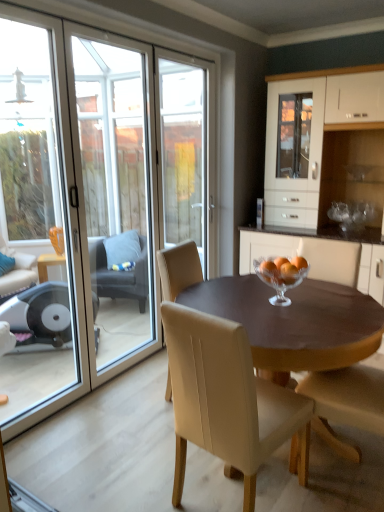
How much space does dark gray fabric chair at left, marked as the first chair in a back-to-front arrangement, occupy horizontally?

dark gray fabric chair at left, marked as the first chair in a back-to-front arrangement, is 54.59 centimeters wide.

Find the location of a particular element. The height and width of the screenshot is (512, 384). clear glass bowl at center is located at coordinates (281, 275).

What do you see at coordinates (116, 195) in the screenshot? I see `transparent glass screen door at left` at bounding box center [116, 195].

At what (x,y) coordinates should I click in order to perform the action: click on transparent glass screen door at left. Please return your answer as a coordinate pair (x, y). Image resolution: width=384 pixels, height=512 pixels. Looking at the image, I should click on (116, 195).

Find the location of a particular element. The height and width of the screenshot is (512, 384). beige leather chair at center, which is counted as the 4th chair, starting from the left is located at coordinates (333, 260).

How distant is dark gray fabric chair at left, the fourth chair when ordered from front to back, from beige leather chair at center, which is counted as the 4th chair, starting from the left?

6.82 feet.

Is dark gray fabric chair at left, marked as the first chair in a back-to-front arrangement, next to beige leather chair at center, arranged as the third chair when viewed from the back?

dark gray fabric chair at left, marked as the first chair in a back-to-front arrangement, and beige leather chair at center, arranged as the third chair when viewed from the back, are clearly separated.

Is dark gray fabric chair at left, arranged as the first chair when viewed from the left, taller than beige leather chair at center, arranged as the first chair when viewed from the right?

In fact, dark gray fabric chair at left, arranged as the first chair when viewed from the left, may be shorter than beige leather chair at center, arranged as the first chair when viewed from the right.

Is point (93, 281) positioned in front of point (307, 237)?

No, it is not.

In terms of height, does dark gray fabric chair at left, arranged as the first chair when viewed from the left, look taller or shorter compared to beige leather chair at center, the third chair when ordered from right to left?

Clearly, dark gray fabric chair at left, arranged as the first chair when viewed from the left, is shorter compared to beige leather chair at center, the third chair when ordered from right to left.

Is dark gray fabric chair at left, the fourth chair when ordered from front to back, wider than beige leather chair at center, the third chair when ordered from right to left?

Yes, dark gray fabric chair at left, the fourth chair when ordered from front to back, is wider than beige leather chair at center, the third chair when ordered from right to left.

How distant is dark gray fabric chair at left, marked as the first chair in a back-to-front arrangement, from beige leather chair at center, which is counted as the 2th chair, starting from the left?

dark gray fabric chair at left, marked as the first chair in a back-to-front arrangement, and beige leather chair at center, which is counted as the 2th chair, starting from the left, are 1.56 meters apart.

In order to click on the 1st chair in front of the dark gray fabric chair at left, the fourth chair when ordered from front to back in this screenshot , I will do `click(179, 269)`.

This screenshot has width=384, height=512. Find the location of `cabinetry located above the wooden table at center (from a real-world perspective)`. cabinetry located above the wooden table at center (from a real-world perspective) is located at coordinates (326, 145).

Does white glossy cabinet at center have a greater width compared to wooden table at center?

Incorrect, the width of white glossy cabinet at center does not surpass that of wooden table at center.

Can you confirm if white glossy cabinet at center is positioned to the right of wooden table at center?

Indeed, white glossy cabinet at center is positioned on the right side of wooden table at center.

Would you say white glossy cabinet at center is inside or outside wooden table at center?

white glossy cabinet at center is not inside wooden table at center, it's outside.

Is transparent glass door at left positioned before wooden table at center?

No, transparent glass door at left is behind wooden table at center.

Is point (35, 169) more distant than point (303, 314)?

That is True.

Is transparent glass door at left bigger than wooden table at center?

Actually, transparent glass door at left might be smaller than wooden table at center.

Would you say beige leather chair at center, which ranks as the 2th chair in right-to-left order, is inside or outside transparent glass screen door at left?

The correct answer is: outside.

Between beige leather chair at center, the first chair positioned from the front, and transparent glass screen door at left, which one is positioned behind?

transparent glass screen door at left.

From the image's perspective, would you say beige leather chair at center, arranged as the 3th chair when viewed from the left, is positioned over transparent glass screen door at left?

No.

From a real-world perspective, between beige leather chair at center, which is the 2th chair in back-to-front order, and beige leather chair at center, which is counted as the 4th chair, starting from the left, who is vertically higher?

beige leather chair at center, which is counted as the 4th chair, starting from the left, from a real-world perspective.

Which of these two, beige leather chair at center, positioned as the 3th chair in front-to-back order, or beige leather chair at center, arranged as the first chair when viewed from the right, is smaller?

Smaller between the two is beige leather chair at center, positioned as the 3th chair in front-to-back order.

Is beige leather chair at center, which is the 2th chair in back-to-front order, further to the viewer compared to beige leather chair at center, arranged as the third chair when viewed from the back?

Yes, it is.

Between beige leather chair at center, positioned as the 3th chair in front-to-back order, and beige leather chair at center, which is counted as the 4th chair, starting from the left, which one has less height?

Standing shorter between the two is beige leather chair at center, which is counted as the 4th chair, starting from the left.

Which is more distant, (x=143, y=269) or (x=291, y=261)?

The point (x=143, y=269) is behind.

Consider the image. From the image's perspective, is dark gray fabric chair at left, marked as the first chair in a back-to-front arrangement, positioned above or below clear glass bowl at center?

Clearly, from the image's perspective, dark gray fabric chair at left, marked as the first chair in a back-to-front arrangement, is below clear glass bowl at center.

Is dark gray fabric chair at left, arranged as the first chair when viewed from the left, far from clear glass bowl at center?

Yes.

Considering the sizes of objects dark gray fabric chair at left, arranged as the first chair when viewed from the left, and clear glass bowl at center in the image provided, who is thinner, dark gray fabric chair at left, arranged as the first chair when viewed from the left, or clear glass bowl at center?

clear glass bowl at center is thinner.

I want to click on the 3rd chair positioned below the beige leather chair at center, acting as the 2th chair starting from the front (from a real-world perspective), so click(x=118, y=274).

You are a GUI agent. You are given a task and a screenshot of the screen. Output one action in this format:
    pyautogui.click(x=<x>, y=<y>)
    Task: Click on the 2nd chair positioned above the dark gray fabric chair at left, marked as the first chair in a back-to-front arrangement (from a real-world perspective)
    
    Given the screenshot: What is the action you would take?
    pyautogui.click(x=179, y=269)

Which object lies further to the anchor point transparent glass screen door at left, beige leather chair at center, arranged as the first chair when viewed from the right, or white glossy cabinet at center?

beige leather chair at center, arranged as the first chair when viewed from the right, is further to transparent glass screen door at left.

Estimate the real-world distances between objects in this image. Which object is closer to white glossy cabinet at center, clear glass bowl at center or transparent glass screen door at left?

Based on the image, clear glass bowl at center appears to be nearer to white glossy cabinet at center.

Considering their positions, is beige leather chair at center, arranged as the first chair when viewed from the right, positioned closer to transparent glass door at left than transparent glass screen door at left?

Among the two, transparent glass screen door at left is located nearer to transparent glass door at left.

From the image, which object appears to be farther from beige leather chair at center, the third chair when ordered from right to left, clear glass bowl at center or transparent glass door at left?

The object further to beige leather chair at center, the third chair when ordered from right to left, is transparent glass door at left.

Estimate the real-world distances between objects in this image. Which object is further from transparent glass screen door at left, white glossy cabinet at center or transparent glass door at left?

white glossy cabinet at center is positioned further to the anchor transparent glass screen door at left.

Looking at the image, which one is located closer to dark gray fabric chair at left, arranged as the first chair when viewed from the left, beige leather chair at center, which ranks as the 2th chair in right-to-left order, or clear glass bowl at center?

clear glass bowl at center is closer to dark gray fabric chair at left, arranged as the first chair when viewed from the left.

Consider the image. Based on their spatial positions, is clear glass bowl at center or white glossy cabinet at center closer to dark gray fabric chair at left, arranged as the first chair when viewed from the left?

white glossy cabinet at center is closer to dark gray fabric chair at left, arranged as the first chair when viewed from the left.

Looking at the image, which one is located further to clear glass bowl at center, wooden table at center or white glossy cabinet at center?

white glossy cabinet at center is positioned further to the anchor clear glass bowl at center.

The width and height of the screenshot is (384, 512). I want to click on glass bowl between transparent glass screen door at left and beige leather chair at center, which is counted as the 4th chair, starting from the left, so click(281, 275).

This screenshot has height=512, width=384. Identify the location of glass bowl between transparent glass door at left and beige leather chair at center, which ranks as the 2th chair in right-to-left order, in the up-down direction. (281, 275).

Find the location of `kitchen & dining room table between beige leather chair at center, which ranks as the 2th chair in right-to-left order, and beige leather chair at center, which is counted as the 4th chair, starting from the left, along the z-axis`. kitchen & dining room table between beige leather chair at center, which ranks as the 2th chair in right-to-left order, and beige leather chair at center, which is counted as the 4th chair, starting from the left, along the z-axis is located at coordinates (280, 315).

Where is `glass bowl located between wooden table at center and dark gray fabric chair at left, marked as the first chair in a back-to-front arrangement, in the depth direction`? The height and width of the screenshot is (512, 384). glass bowl located between wooden table at center and dark gray fabric chair at left, marked as the first chair in a back-to-front arrangement, in the depth direction is located at coordinates (281, 275).